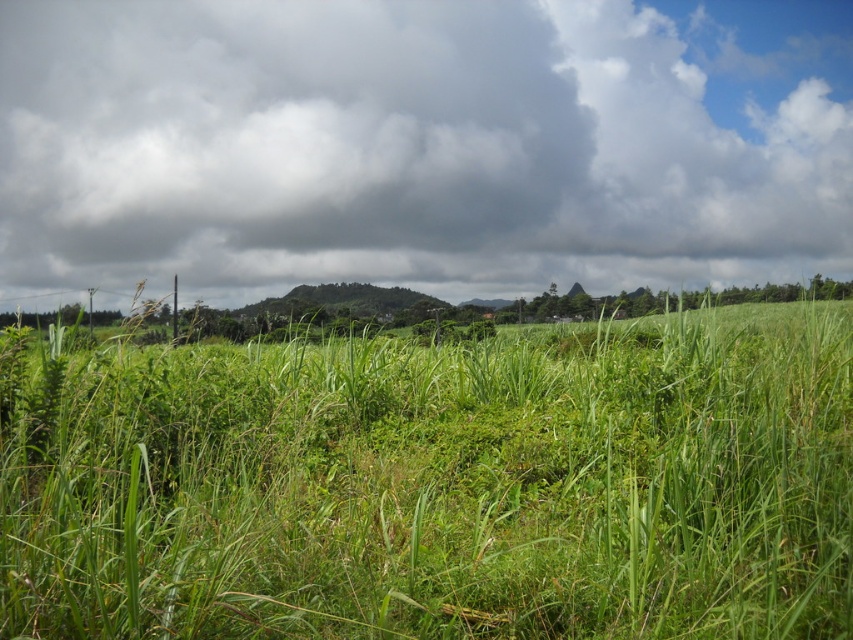
You are standing in the lush green landscape described. There is a point marked at coordinates (439, 484). Based on the scene description, what is located at this point?

The point at coordinates (439, 484) marks the green grassy field at center, as indicated by the Objects Description.

You are a landscape photographer planning to capture the entire scene. Given that the green grassy field at center and the dark gray cloud at upper center are both in your frame, which object occupies a smaller width in the image?

The green grassy field at center has a lesser width compared to the dark gray cloud at upper center, so the green grassy field at center occupies a smaller width in the image.